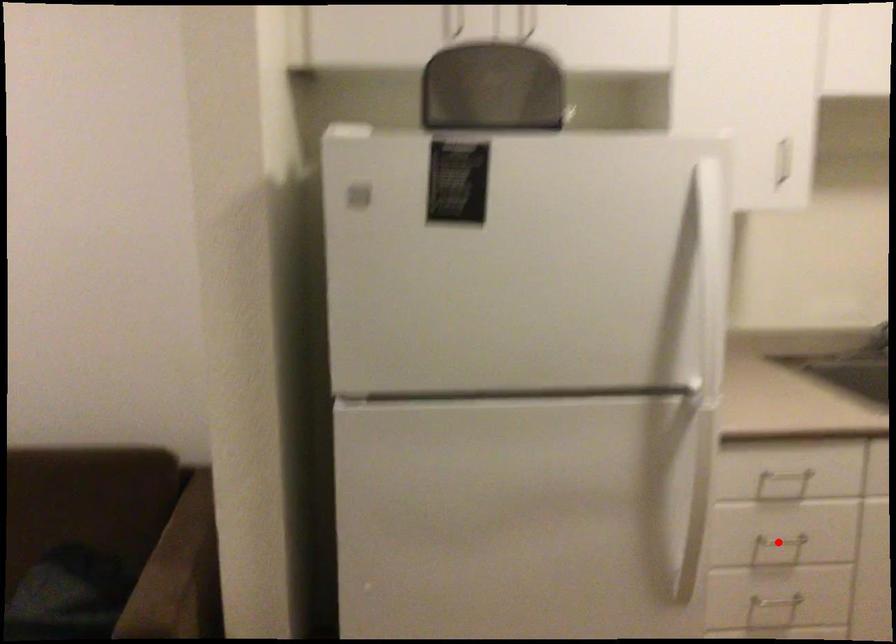
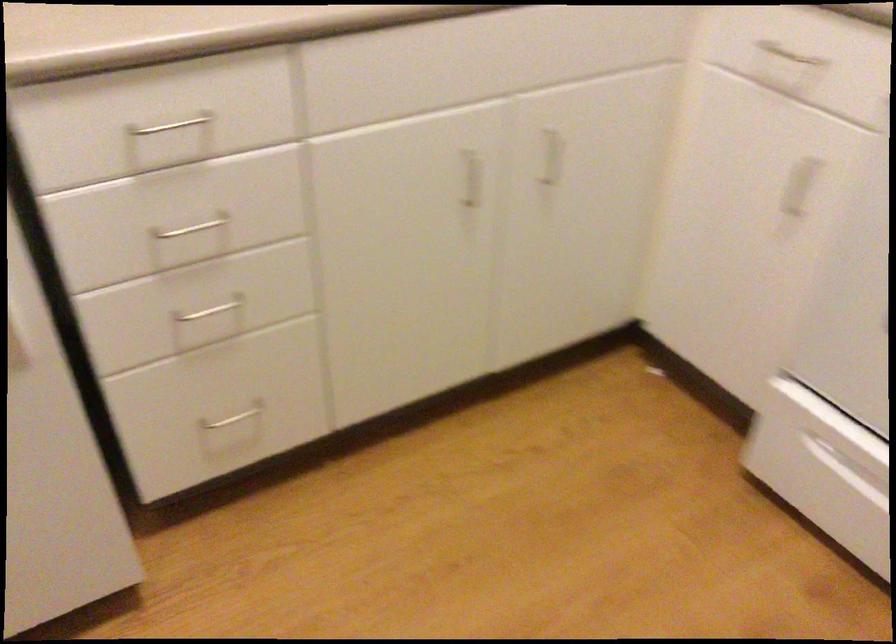
Question: I am providing you with two images of the same scene from different viewpoints. Image1 has a red point marked. In image2, the corresponding 3D location appears at what relative position? Reply with the corresponding letter.

Choices:
 (A) Closer
 (B) Farther

Answer: (A)